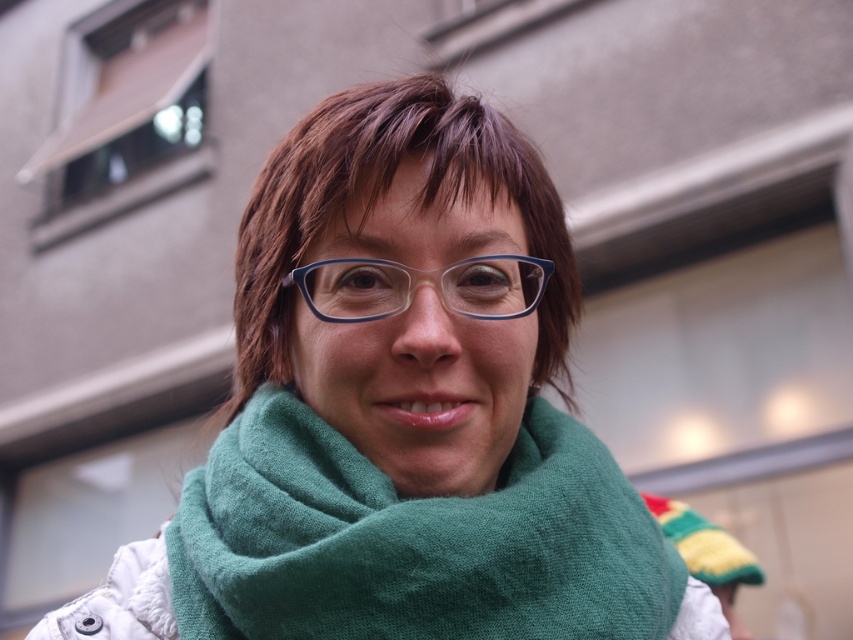
You are standing in front of the person in the image. Where is the green woolen scarf located in relation to the point marked at coordinate (412, 540)?

The point marked at coordinate (412, 540) is exactly where the green woolen scarf is located at center.

You are a photographer trying to capture the subject in this image. You notice the green woolen scarf at center and the transparent blue glasses at center. Which object is positioned more to the right side of the frame?

The green woolen scarf at center is positioned to the right of the transparent blue glasses at center, so the green woolen scarf at center is more to the right side of the frame.

You are a fashion designer analyzing the image. You need to determine which item has a greater width between the green woolen scarf at center and the transparent blue glasses at center. Which one is wider?

The green woolen scarf at center is wider than the transparent blue glasses at center according to the description.